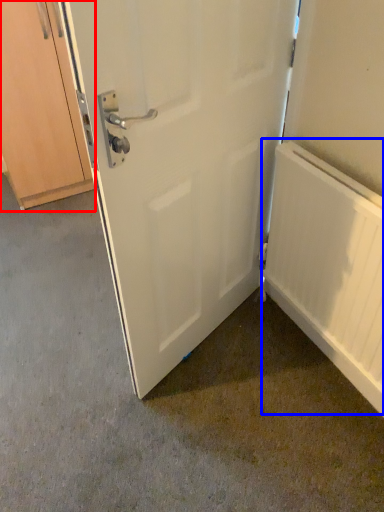
Question: Among these objects, which one is nearest to the camera, cabinetry (highlighted by a red box) or radiator (highlighted by a blue box)?

Choices:
 (A) cabinetry
 (B) radiator

Answer: (B)